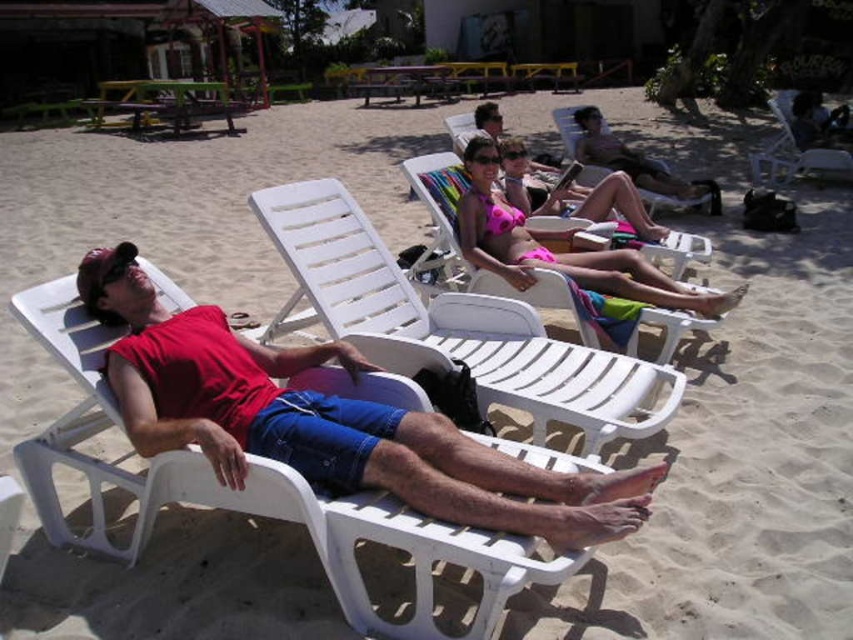
Who is more distant from viewer, [527,531] or [576,260]?

The point [576,260] is more distant.

Is point (329, 349) more distant than point (509, 237)?

That is False.

Who is more distant from viewer, (392, 488) or (660, 276)?

Point (660, 276)

The image size is (853, 640). I want to click on red matte/vinyl man at center, so click(x=328, y=420).

In the scene shown: Between pink fabric bikini at center and white plastic beach chair at upper right, which one appears on the left side from the viewer's perspective?

From the viewer's perspective, pink fabric bikini at center appears more on the left side.

Which is more to the right, pink fabric bikini at center or white plastic beach chair at upper right?

From the viewer's perspective, white plastic beach chair at upper right appears more on the right side.

Is point (610, 289) positioned in front of point (793, 96)?

Yes, it is.

Identify the location of pink fabric bikini at center. The height and width of the screenshot is (640, 853). (560, 252).

Is point (573, 416) positioned in front of point (653, 177)?

Yes, it is.

Who is taller, white plastic beach chair at center or pink fabric beach chair at center?

pink fabric beach chair at center is taller.

What do you see at coordinates (451, 324) in the screenshot? I see `white plastic beach chair at center` at bounding box center [451, 324].

The width and height of the screenshot is (853, 640). Find the location of `white plastic beach chair at center`. white plastic beach chair at center is located at coordinates (451, 324).